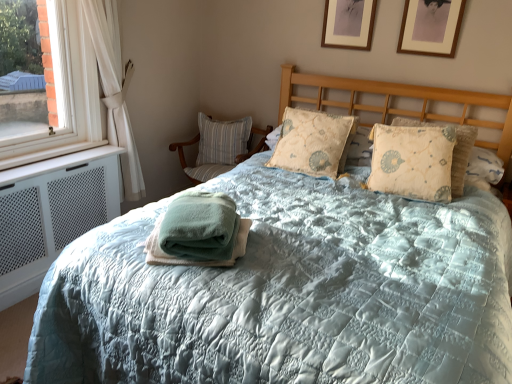
In order to face striped fabric pillow at left, the 1th pillow viewed from the back, should I rotate leftwards or rightwards?

A 5.017 degree turn to the left will do.

Describe the element at coordinates (222, 140) in the screenshot. I see `striped fabric pillow at left, arranged as the 1th pillow when viewed from the left` at that location.

Locate an element on the screen. green cotton towel at center is located at coordinates (198, 232).

The height and width of the screenshot is (384, 512). I want to click on striped fabric chair at left, so click(x=217, y=161).

Image resolution: width=512 pixels, height=384 pixels. I want to click on white sheer curtain at left, so click(101, 81).

The image size is (512, 384). In order to click on wooden picture frame at upper right, which is the first picture frame in left-to-right order in this screenshot , I will do `click(348, 24)`.

Identify the location of striped fabric pillow at left, arranged as the 1th pillow when viewed from the left. (222, 140).

Looking at this image, which object is thinner, wooden picture frame at upper right, acting as the first picture frame starting from the right, or striped fabric pillow at left, the 1th pillow viewed from the back?

With smaller width is wooden picture frame at upper right, acting as the first picture frame starting from the right.

Would you consider wooden picture frame at upper right, the 2th picture frame from the left, to be distant from striped fabric pillow at left, acting as the third pillow starting from the right?

That's right, there is a large distance between wooden picture frame at upper right, the 2th picture frame from the left, and striped fabric pillow at left, acting as the third pillow starting from the right.

Is the position of wooden picture frame at upper right, the 2th picture frame from the left, less distant than that of striped fabric pillow at left, arranged as the 1th pillow when viewed from the left?

Yes, the depth of wooden picture frame at upper right, the 2th picture frame from the left, is less than that of striped fabric pillow at left, arranged as the 1th pillow when viewed from the left.

Is wooden picture frame at upper right, the 2th picture frame from the left, inside the boundaries of striped fabric pillow at left, acting as the third pillow starting from the right, or outside?

wooden picture frame at upper right, the 2th picture frame from the left, is not inside striped fabric pillow at left, acting as the third pillow starting from the right, it's outside.

Which of these two, white sheer curtain at left or green cotton towel at center, is smaller?

Smaller between the two is green cotton towel at center.

Which is more to the right, white sheer curtain at left or green cotton towel at center?

Positioned to the right is green cotton towel at center.

From the image's perspective, is white sheer curtain at left positioned above or below green cotton towel at center?

Clearly, from the image's perspective, white sheer curtain at left is above green cotton towel at center.

From a real-world perspective, is white sheer curtain at left beneath green cotton towel at center?

No, from a real-world perspective, white sheer curtain at left is not below green cotton towel at center.

Between wooden picture frame at upper right, the second picture frame from the right, and striped fabric chair at left, which one is positioned behind?

striped fabric chair at left is more distant.

Is wooden picture frame at upper right, the second picture frame from the right, situated inside striped fabric chair at left or outside?

wooden picture frame at upper right, the second picture frame from the right, is located beyond the bounds of striped fabric chair at left.

Locate an element on the screen. The height and width of the screenshot is (384, 512). picture frame that is the 1st object located in front of the striped fabric chair at left is located at coordinates (348, 24).

How many degrees apart are the facing directions of white sheer curtain at left and white mesh air conditioner at left?

The facing directions of white sheer curtain at left and white mesh air conditioner at left are 3.53e-05 degrees apart.

Between white sheer curtain at left and white mesh air conditioner at left, which one has more height?

white sheer curtain at left is taller.

Based on the photo, considering the sizes of white sheer curtain at left and white mesh air conditioner at left in the image, is white sheer curtain at left bigger or smaller than white mesh air conditioner at left?

Clearly, white sheer curtain at left is larger in size than white mesh air conditioner at left.

Between white mesh air conditioner at left and white sheer curtain at left, which one is positioned behind?

white sheer curtain at left is more distant.

Which is behind, point (59, 197) or point (101, 68)?

Positioned behind is point (101, 68).

Is white mesh air conditioner at left positioned with its back to white sheer curtain at left?

That's not correct — white mesh air conditioner at left is not looking away from white sheer curtain at left.

The height and width of the screenshot is (384, 512). I want to click on curtain located above the white mesh air conditioner at left (from the image's perspective), so click(x=101, y=81).

Can you confirm if beige textured pillow at center, the third pillow from the left, is positioned to the left of wooden picture frame at upper right, the 2th picture frame from the left?

Yes.

Is wooden picture frame at upper right, acting as the first picture frame starting from the right, completely or partially inside beige textured pillow at center, marked as the first pillow in a right-to-left arrangement?

Actually, wooden picture frame at upper right, acting as the first picture frame starting from the right, is outside beige textured pillow at center, marked as the first pillow in a right-to-left arrangement.

Does beige textured pillow at center, which appears as the third pillow when viewed from the back, have a smaller size compared to wooden picture frame at upper right, acting as the first picture frame starting from the right?

No, beige textured pillow at center, which appears as the third pillow when viewed from the back, is not smaller than wooden picture frame at upper right, acting as the first picture frame starting from the right.

Does point (447, 193) come closer to viewer compared to point (440, 46)?

Yes, it is in front of point (440, 46).

Identify the location of blanket located below the striped fabric pillow at left, acting as the third pillow starting from the right (from the image's perspective). The image size is (512, 384). (198, 232).

Is striped fabric pillow at left, acting as the third pillow starting from the right, spatially inside green cotton towel at center, or outside of it?

striped fabric pillow at left, acting as the third pillow starting from the right, cannot be found inside green cotton towel at center.

Based on the photo, which object is wider, striped fabric pillow at left, acting as the third pillow starting from the right, or green cotton towel at center?

With larger width is green cotton towel at center.

Are striped fabric pillow at left, the 1th pillow viewed from the back, and green cotton towel at center far apart?

Yes, striped fabric pillow at left, the 1th pillow viewed from the back, is far from green cotton towel at center.

From a real-world perspective, which pillow is the 3rd one underneath the wooden picture frame at upper right, acting as the first picture frame starting from the right? Please provide its 2D coordinates.

[(222, 140)]

The width and height of the screenshot is (512, 384). What are the coordinates of `blanket that appears on the right of white sheer curtain at left` in the screenshot? It's located at (198, 232).

Estimate the real-world distances between objects in this image. Which object is further from green cotton towel at center, wooden picture frame at upper right, which is the first picture frame in left-to-right order, or wooden picture frame at upper right, the 2th picture frame from the left?

wooden picture frame at upper right, which is the first picture frame in left-to-right order.

In the scene shown: Based on their spatial positions, is beige textured pillow at center, marked as the first pillow in a right-to-left arrangement, or striped fabric chair at left further from wooden picture frame at upper right, the 2th picture frame from the left?

striped fabric chair at left is further to wooden picture frame at upper right, the 2th picture frame from the left.

Looking at the image, which one is located further to beige quilted pillow at center, the second pillow in the back-to-front sequence, striped fabric pillow at left, the 1th pillow viewed from the back, or striped fabric chair at left?

striped fabric pillow at left, the 1th pillow viewed from the back, is further to beige quilted pillow at center, the second pillow in the back-to-front sequence.

Considering their positions, is striped fabric chair at left positioned closer to white sheer curtain at left than striped fabric pillow at left, the 1th pillow viewed from the back?

striped fabric chair at left lies closer to white sheer curtain at left than the other object.

Estimate the real-world distances between objects in this image. Which object is further from white sheer curtain at left, beige textured pillow at center, marked as the first pillow in a right-to-left arrangement, or wooden picture frame at upper right, the second picture frame from the right?

beige textured pillow at center, marked as the first pillow in a right-to-left arrangement.

From the image, which object appears to be farther from striped fabric chair at left, striped fabric pillow at left, the third pillow when ordered from front to back, or white sheer curtain at left?

white sheer curtain at left lies further to striped fabric chair at left than the other object.

When comparing their distances from beige textured pillow at center, marked as the first pillow in a right-to-left arrangement, does green cotton towel at center or wooden picture frame at upper right, the 2th picture frame from the left, seem further?

green cotton towel at center is positioned further to the anchor beige textured pillow at center, marked as the first pillow in a right-to-left arrangement.

Looking at the image, which one is located closer to white mesh air conditioner at left, green cotton towel at center or white sheer curtain at left?

The object closer to white mesh air conditioner at left is white sheer curtain at left.

The image size is (512, 384). What are the coordinates of `chair located between white mesh air conditioner at left and beige textured pillow at center, marked as the first pillow in a right-to-left arrangement, in the left-right direction` in the screenshot? It's located at (217, 161).

The height and width of the screenshot is (384, 512). In order to click on blanket between white mesh air conditioner at left and wooden picture frame at upper right, the 2th picture frame from the left, in the horizontal direction in this screenshot , I will do `click(198, 232)`.

Locate an element on the screen. The height and width of the screenshot is (384, 512). picture frame that lies between wooden picture frame at upper right, which is the first picture frame in left-to-right order, and beige textured pillow at center, marked as the first pillow in a right-to-left arrangement, from top to bottom is located at coordinates (431, 27).

Identify the location of curtain located between white mesh air conditioner at left and striped fabric pillow at left, the 1th pillow viewed from the back, in the depth direction. Image resolution: width=512 pixels, height=384 pixels. (101, 81).